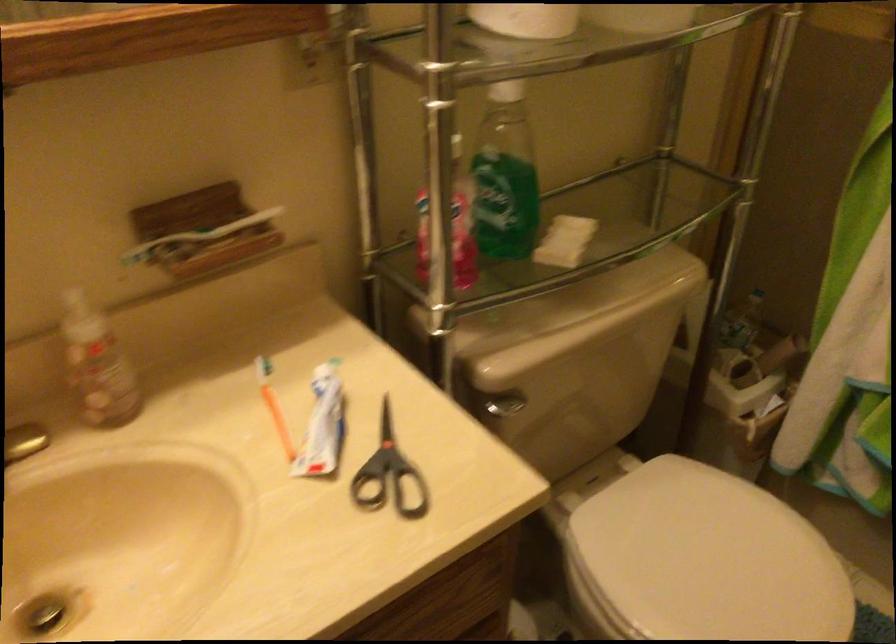
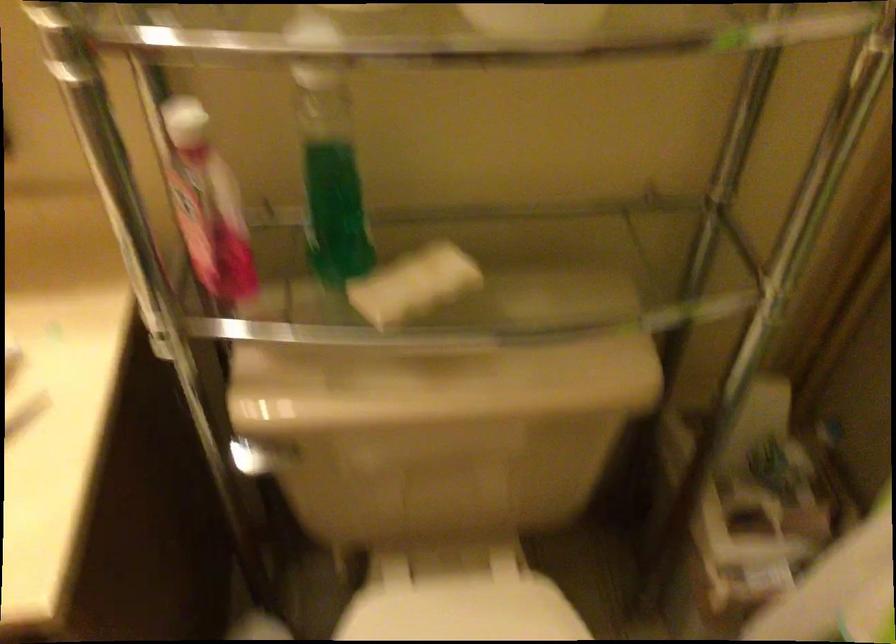
Question: The first image is from the beginning of the video and the second image is from the end. How did the camera likely rotate when shooting the video?

Choices:
 (A) Left
 (B) Right
 (C) Up
 (D) Down

Answer: (A)